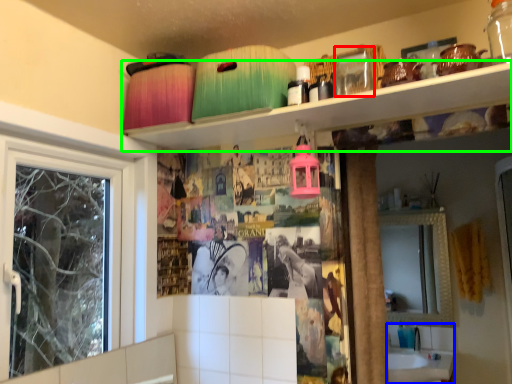
Question: Considering the real-world distances, which object is closest to glass jar (highlighted by a red box)? sink (highlighted by a blue box) or shelf (highlighted by a green box).

Choices:
 (A) sink
 (B) shelf

Answer: (B)